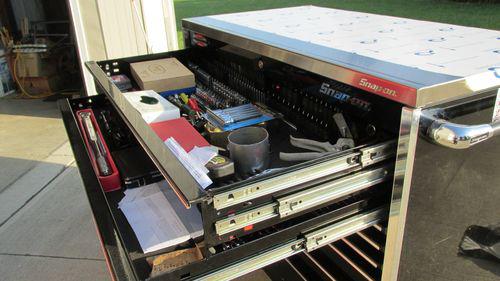
The height and width of the screenshot is (281, 500). What are the coordinates of `wooden box` in the screenshot? It's located at (163, 67).